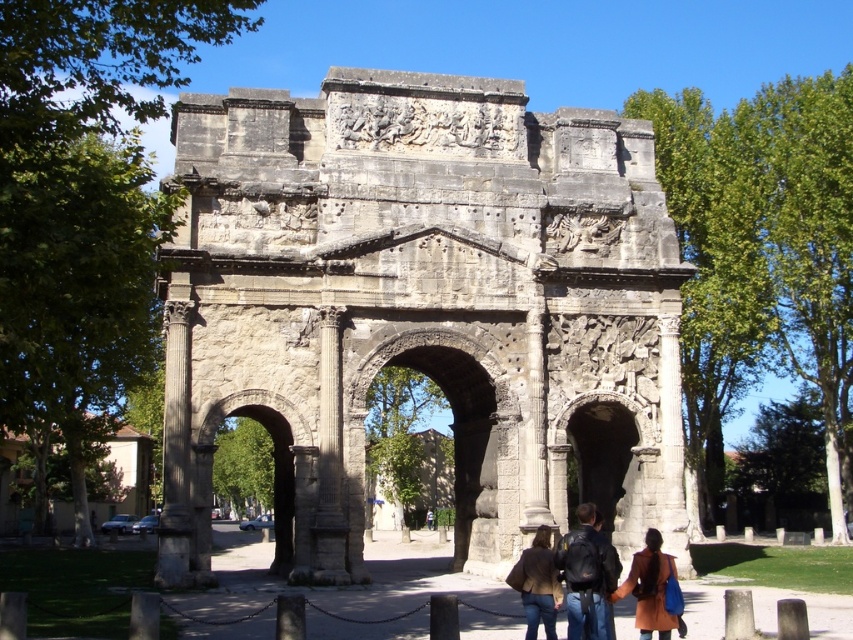
Can you confirm if gray stone column at left is taller than brown leather jacket at lower center?

Yes, gray stone column at left is taller than brown leather jacket at lower center.

Can you confirm if gray stone column at left is shorter than brown leather jacket at lower center?

Incorrect, gray stone column at left's height does not fall short of brown leather jacket at lower center's.

Does point (177, 560) come closer to viewer compared to point (561, 589)?

No.

Identify the location of gray stone column at left. The width and height of the screenshot is (853, 640). (175, 451).

Between gray stone column at left and olive brown leather coat at center, which one appears on the left side from the viewer's perspective?

gray stone column at left

How much distance is there between gray stone column at left and olive brown leather coat at center?

gray stone column at left is 84.78 feet from olive brown leather coat at center.

Find the location of `gray stone column at left`. gray stone column at left is located at coordinates (175, 451).

Locate an element on the screen. The height and width of the screenshot is (640, 853). gray stone column at left is located at coordinates (175, 451).

Does gray stone column at center have a smaller size compared to dark blue leather jacket at center?

No.

At what (x,y) coordinates should I click in order to perform the action: click on gray stone column at center. Please return your answer as a coordinate pair (x, y). The height and width of the screenshot is (640, 853). Looking at the image, I should click on (329, 458).